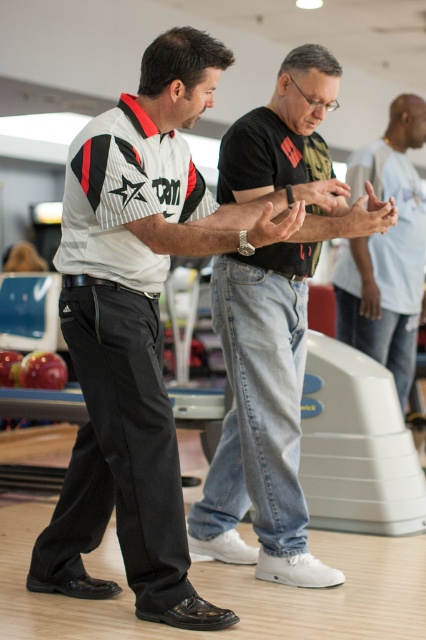
Does point (279, 276) lie in front of point (408, 112)?

Yes, it is in front of point (408, 112).

Is jeans at center to the left of denim jeans at center from the viewer's perspective?

Correct, you'll find jeans at center to the left of denim jeans at center.

Between point (290, 561) and point (360, 259), which one is positioned behind?

The point (360, 259) is more distant.

Find the location of `jeans at center`. jeans at center is located at coordinates (268, 397).

Between white matte shirt at center and denim jeans at center, which one has more height?

white matte shirt at center is taller.

Based on the photo, which is below, white matte shirt at center or denim jeans at center?

Result: Positioned lower is white matte shirt at center.

At what (x,y) coordinates should I click in order to perform the action: click on white matte shirt at center. Please return your answer as a coordinate pair (x, y). Looking at the image, I should click on (140, 326).

Does point (104, 262) come farther from viewer compared to point (333, 580)?

That is False.

Does point (89, 362) come closer to viewer compared to point (302, 374)?

That is True.

Image resolution: width=426 pixels, height=640 pixels. In order to click on white matte shirt at center in this screenshot , I will do `click(140, 326)`.